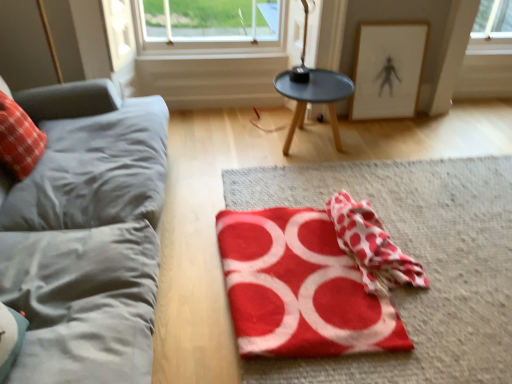
The image size is (512, 384). In order to click on free point below black matte table at center (from a real-world perspective) in this screenshot , I will do `click(307, 148)`.